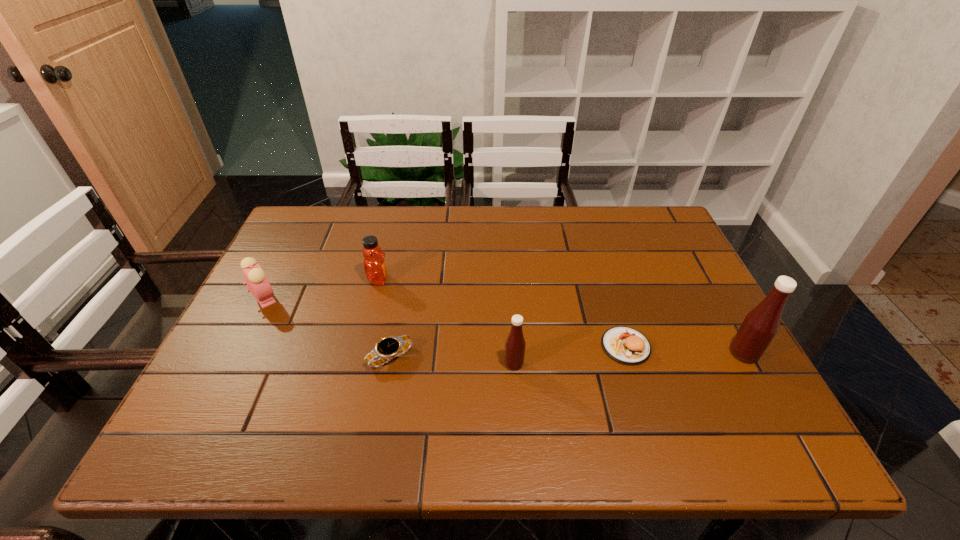
The image size is (960, 540). I want to click on blank area located 0.340m on the right of the left Tabasco sauce, so click(x=677, y=364).

The width and height of the screenshot is (960, 540). What are the coordinates of `vacant space located 0.100m on the front of the tallest object` in the screenshot? It's located at (772, 406).

This screenshot has width=960, height=540. I want to click on vacant space located 0.180m on the front label of the honey, so click(x=457, y=280).

Find the location of a particular element. Image resolution: width=960 pixels, height=540 pixels. free point located 0.280m on the face of the leftmost object is located at coordinates (391, 298).

Locate an element on the screen. The width and height of the screenshot is (960, 540). vacant position located on the back of the second shortest object is located at coordinates (592, 240).

The width and height of the screenshot is (960, 540). In order to click on vacant space located on the right of the shortest object in this screenshot , I will do `click(529, 357)`.

Locate an element on the screen. The height and width of the screenshot is (540, 960). object that is at the left edge is located at coordinates (257, 282).

Where is `object situated at the right edge`? The height and width of the screenshot is (540, 960). object situated at the right edge is located at coordinates (761, 324).

Locate an element on the screen. vacant space at the far edge of the desktop is located at coordinates (468, 215).

Find the location of a particular element. vacant space at the near edge of the desktop is located at coordinates (330, 388).